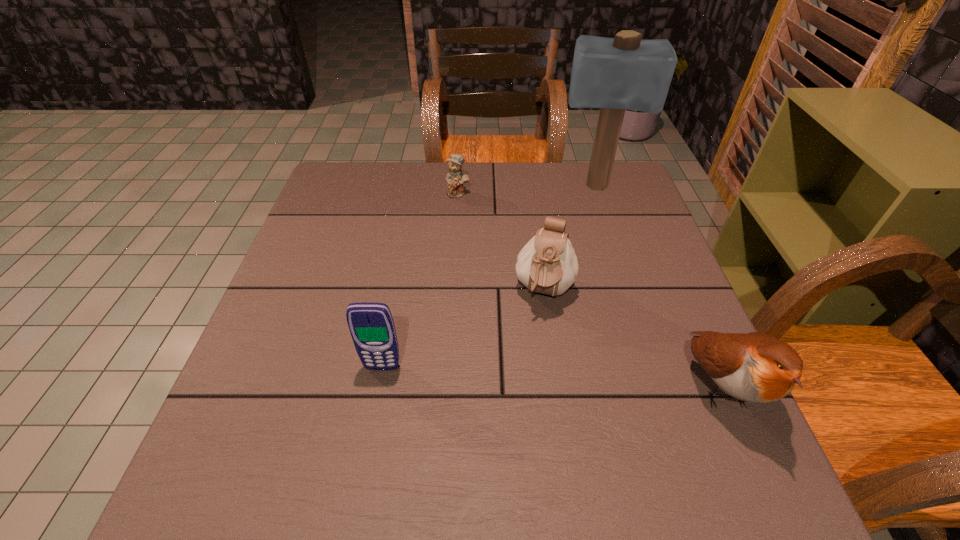
Find the location of `blank space located 0.110m on the front-facing side of the teddy bear`. blank space located 0.110m on the front-facing side of the teddy bear is located at coordinates (479, 221).

Find the location of `free space located on the front-facing side of the third nearest object`. free space located on the front-facing side of the third nearest object is located at coordinates (518, 420).

Where is `vacant space located on the front-facing side of the third nearest object`? vacant space located on the front-facing side of the third nearest object is located at coordinates [x=515, y=436].

Where is `vacant space located 0.150m on the front-facing side of the third nearest object`? The width and height of the screenshot is (960, 540). vacant space located 0.150m on the front-facing side of the third nearest object is located at coordinates (527, 376).

Locate an element on the screen. free region located 0.320m on the striking surface of the tallest object is located at coordinates (592, 286).

Identify the location of free location located on the striking surface of the tallest object. Image resolution: width=960 pixels, height=540 pixels. (593, 231).

The width and height of the screenshot is (960, 540). Find the location of `vacant position located on the striking surface of the tallest object`. vacant position located on the striking surface of the tallest object is located at coordinates (593, 239).

You are a GUI agent. You are given a task and a screenshot of the screen. Output one action in this format:
    pyautogui.click(x=<x>, y=<y>)
    Task: Click on the teddy bear at the far edge
    This screenshot has width=960, height=540.
    Given the screenshot: What is the action you would take?
    pyautogui.click(x=456, y=177)

You are a GUI agent. You are given a task and a screenshot of the screen. Output one action in this format:
    pyautogui.click(x=<x>, y=<y>)
    Task: Click on the mallet that is at the far edge
    The image size is (960, 540).
    Given the screenshot: What is the action you would take?
    pyautogui.click(x=614, y=74)

Find the location of a particular element. Image resolution: width=960 pixels, height=540 pixels. object positioned at the near edge is located at coordinates (754, 367).